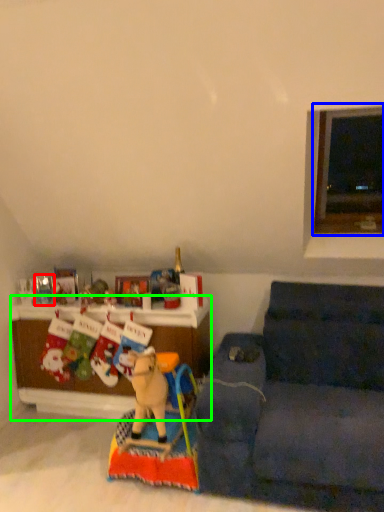
Question: Which object is positioned closest to toy (highlighted by a red box)? Select from window (highlighted by a blue box) and cabinetry (highlighted by a green box).

Choices:
 (A) window
 (B) cabinetry

Answer: (B)